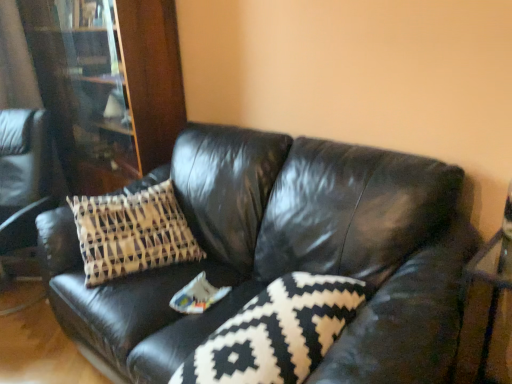
Question: In the image, is wooden bookcase at left positioned in front of or behind black and white patterned pillow at center?

Choices:
 (A) behind
 (B) front

Answer: (A)

Question: Is wooden bookcase at left bigger or smaller than black and white patterned pillow at center?

Choices:
 (A) small
 (B) big

Answer: (B)

Question: Which object is the farthest from the black and white patterned pillow at center?

Choices:
 (A) wooden bookcase at left
 (B) black leather couch at center

Answer: (A)

Question: Based on their relative distances, which object is farther from the black leather couch at center?

Choices:
 (A) wooden bookcase at left
 (B) black and white patterned pillow at center

Answer: (A)